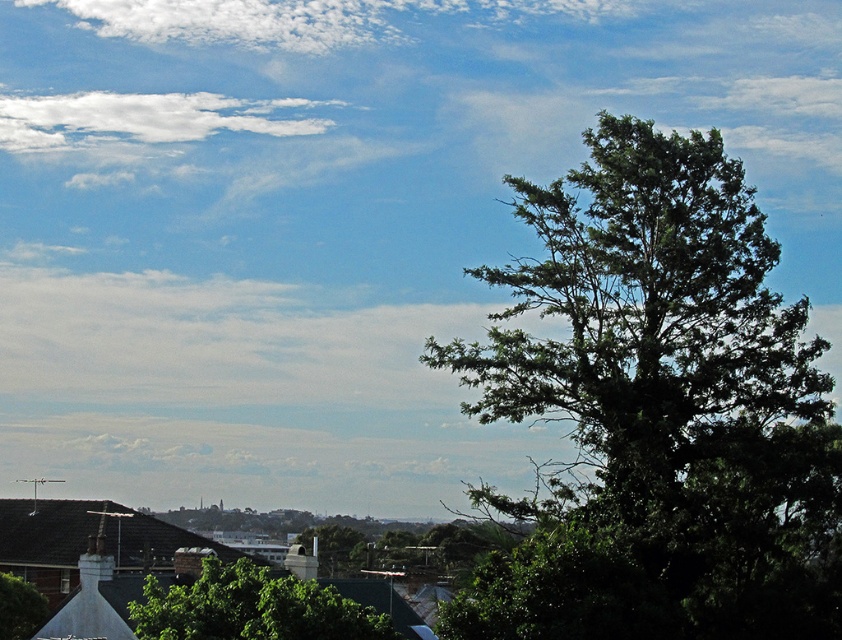
Between white fluffy cloud at upper center and green leafy tree at lower left, which one is positioned lower?

green leafy tree at lower left is lower down.

Is white fluffy cloud at upper center wider than green leafy tree at lower left?

Correct, the width of white fluffy cloud at upper center exceeds that of green leafy tree at lower left.

What do you see at coordinates (299, 19) in the screenshot?
I see `white fluffy cloud at upper center` at bounding box center [299, 19].

I want to click on white fluffy cloud at upper center, so click(299, 19).

Which of these two, green leafy tree at right or green leafy tree at center, stands shorter?

Standing shorter between the two is green leafy tree at center.

Is point (601, 461) more distant than point (398, 637)?

Yes, it is behind point (398, 637).

You are a GUI agent. You are given a task and a screenshot of the screen. Output one action in this format:
    pyautogui.click(x=<x>, y=<y>)
    Task: Click on the green leafy tree at right
    This screenshot has height=640, width=842.
    Given the screenshot: What is the action you would take?
    pyautogui.click(x=657, y=412)

Locate an element on the screen. The image size is (842, 640). green leafy tree at right is located at coordinates (657, 412).

Can you confirm if green leafy tree at right is taller than white fluffy cloud at upper center?

Indeed, green leafy tree at right has a greater height compared to white fluffy cloud at upper center.

Can you confirm if green leafy tree at right is shorter than white fluffy cloud at upper center?

No.

Describe the element at coordinates (657, 412) in the screenshot. I see `green leafy tree at right` at that location.

At what (x,y) coordinates should I click in order to perform the action: click on green leafy tree at right. Please return your answer as a coordinate pair (x, y). Looking at the image, I should click on (657, 412).